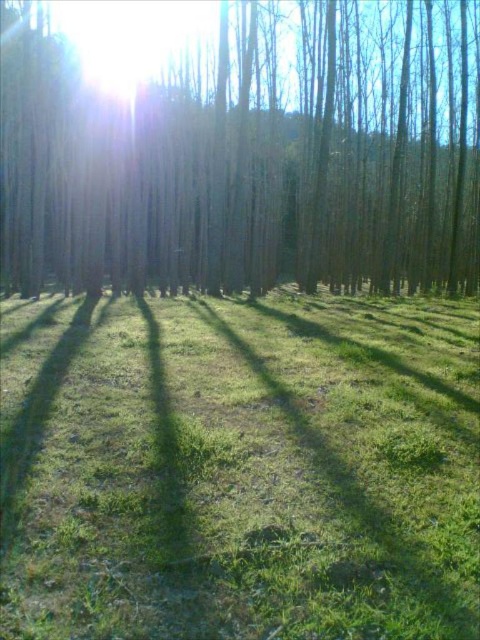
You are standing at the point marked as point (240, 468) in the forest scene. What is the terrain like at that exact location?

The point (240, 468) indicates green grassy at center, so the terrain at that location is green grassy.

You are standing at the center of the forest and want to place a small picnic blanket. The coordinates for the green grassy area at center are given. Can you confirm if the green grassy at center is suitable for placing the picnic blanket?

The green grassy at center is located at coordinates point (240, 468), which is suitable for placing the picnic blanket as it provides a clear area.

Based on the photo, you are navigating through the forest and see two points marked in the image. Which point is closer to you, point [4,618] or point [170,227]?

Point [4,618] is in front of point [170,227], so it is closer to you.